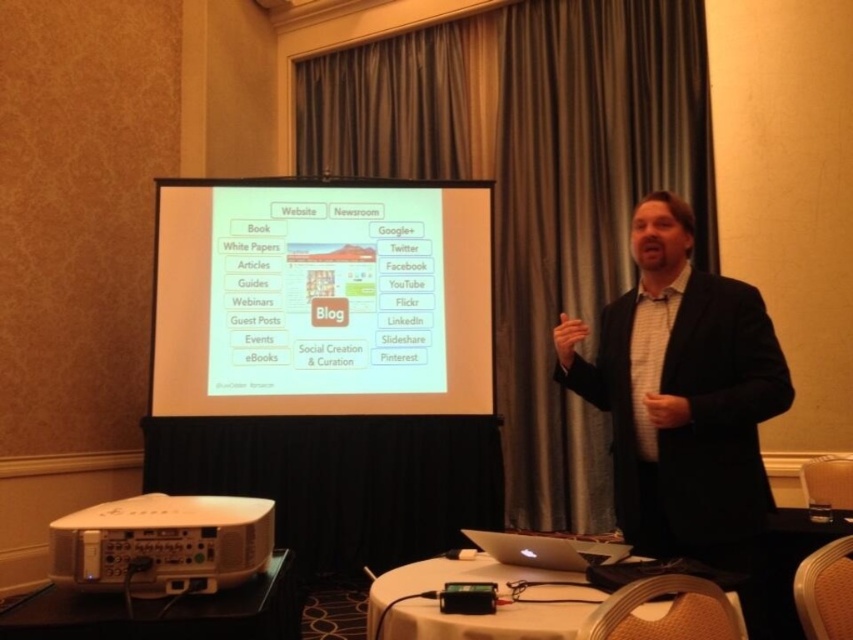
Question: Which point appears farthest from the camera in this image?

Choices:
 (A) (517, 625)
 (B) (151, 593)
 (C) (758, 492)
 (D) (552, 547)

Answer: (C)

Question: Which of the following is the farthest from the observer?

Choices:
 (A) white plastic projector at lower left
 (B) silver metallic laptop at center

Answer: (B)

Question: Is white matte projection screen at center behind black textured suit at center?

Choices:
 (A) no
 (B) yes

Answer: (B)

Question: Is black textured suit at center bigger than silver metallic laptop at center?

Choices:
 (A) no
 (B) yes

Answer: (B)

Question: Among these points, which one is nearest to the camera?

Choices:
 (A) (170, 381)
 (B) (585, 593)

Answer: (B)

Question: Observing the image, what is the correct spatial positioning of black textured suit at center in reference to white plastic table at lower center?

Choices:
 (A) below
 (B) above

Answer: (B)